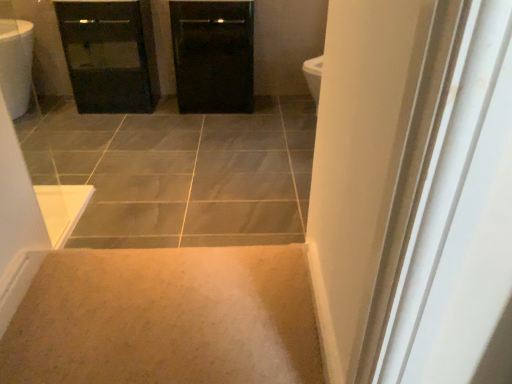
Question: Based on their sizes in the image, would you say black glossy cabinet at center is bigger or smaller than beige carpet at lower center?

Choices:
 (A) big
 (B) small

Answer: (A)

Question: From the image's perspective, is black glossy cabinet at center positioned above or below beige carpet at lower center?

Choices:
 (A) below
 (B) above

Answer: (B)

Question: Estimate the real-world distances between objects in this image. Which object is closer to the beige carpet at lower center?

Choices:
 (A) black glossy cabinet at upper left
 (B) black glossy cabinet at center

Answer: (B)

Question: Estimate the real-world distances between objects in this image. Which object is closer to the black glossy cabinet at upper left?

Choices:
 (A) black glossy cabinet at center
 (B) beige carpet at lower center

Answer: (A)